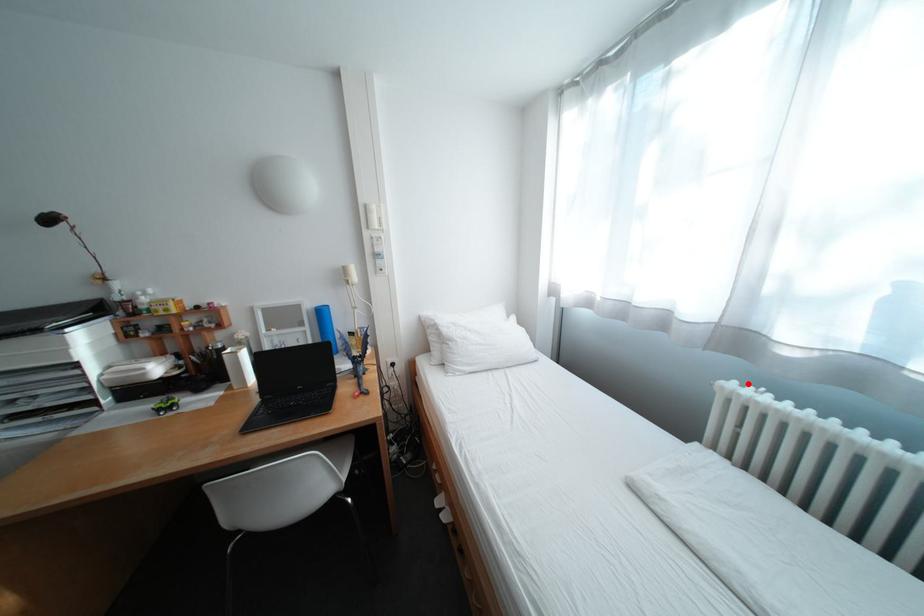
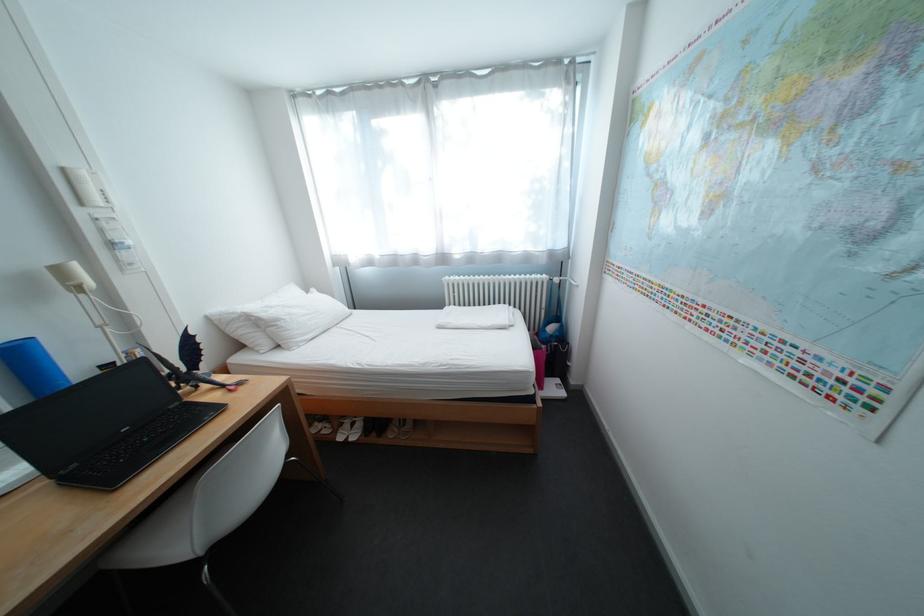
In the second image, find the point that corresponds to the highlighted location in the first image.

(459, 278)